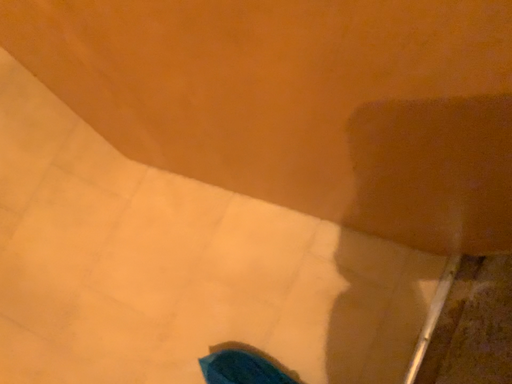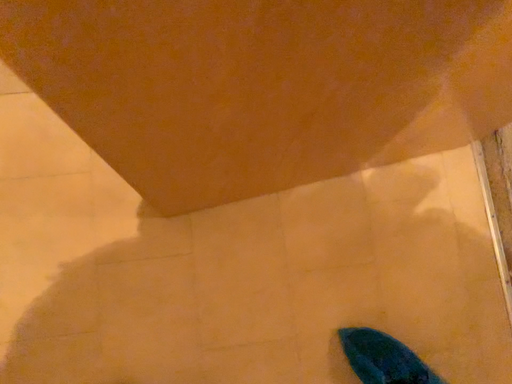
Question: How did the camera likely rotate when shooting the video?

Choices:
 (A) rotated right
 (B) rotated left

Answer: (A)